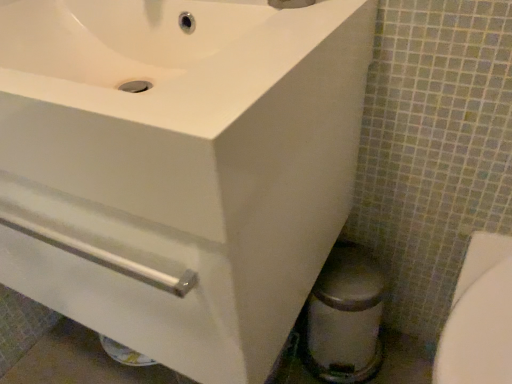
Question: Can you confirm if white glossy sink at upper left is wider than white glossy bidet at lower right?

Choices:
 (A) no
 (B) yes

Answer: (B)

Question: From the image's perspective, is white glossy sink at upper left over white glossy bidet at lower right?

Choices:
 (A) no
 (B) yes

Answer: (B)

Question: Is white glossy sink at upper left in front of white glossy bidet at lower right?

Choices:
 (A) yes
 (B) no

Answer: (A)

Question: Is white glossy sink at upper left next to white glossy bidet at lower right?

Choices:
 (A) yes
 (B) no

Answer: (B)

Question: Considering the relative positions of white glossy sink at upper left and white glossy bidet at lower right in the image provided, is white glossy sink at upper left to the right of white glossy bidet at lower right from the viewer's perspective?

Choices:
 (A) yes
 (B) no

Answer: (B)

Question: Looking at their shapes, would you say brushed metal faucet at upper center is wider or thinner than white glossy sink at upper left?

Choices:
 (A) thin
 (B) wide

Answer: (A)

Question: Is point (307, 0) positioned closer to the camera than point (131, 31)?

Choices:
 (A) closer
 (B) farther

Answer: (A)

Question: Considering the relative positions of brushed metal faucet at upper center and white glossy sink at upper left in the image provided, is brushed metal faucet at upper center to the left or to the right of white glossy sink at upper left?

Choices:
 (A) left
 (B) right

Answer: (B)

Question: Considering the positions of brushed metal faucet at upper center and white glossy sink at upper left in the image, is brushed metal faucet at upper center bigger or smaller than white glossy sink at upper left?

Choices:
 (A) small
 (B) big

Answer: (A)

Question: From the image's perspective, relative to white glossy sink at upper left, is white glossy bidet at lower right above or below?

Choices:
 (A) below
 (B) above

Answer: (A)

Question: In terms of height, does white glossy bidet at lower right look taller or shorter compared to white glossy sink at upper left?

Choices:
 (A) short
 (B) tall

Answer: (B)

Question: From a real-world perspective, relative to white glossy sink at upper left, is white glossy bidet at lower right vertically above or below?

Choices:
 (A) below
 (B) above

Answer: (A)

Question: Is point (446, 380) closer or farther from the camera than point (87, 210)?

Choices:
 (A) closer
 (B) farther

Answer: (B)

Question: Is white glossy sink at upper left to the left or to the right of brushed metal faucet at upper center in the image?

Choices:
 (A) left
 (B) right

Answer: (A)

Question: Considering their positions, is white glossy sink at upper left located in front of or behind brushed metal faucet at upper center?

Choices:
 (A) front
 (B) behind

Answer: (A)